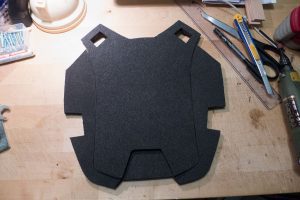
You are a GUI agent. You are given a task and a screenshot of the screen. Output one action in this format:
    pyautogui.click(x=<x>, y=<y>)
    Task: Click on the wood shims
    The width and height of the screenshot is (300, 200).
    Given the screenshot: What is the action you would take?
    pyautogui.click(x=255, y=14)